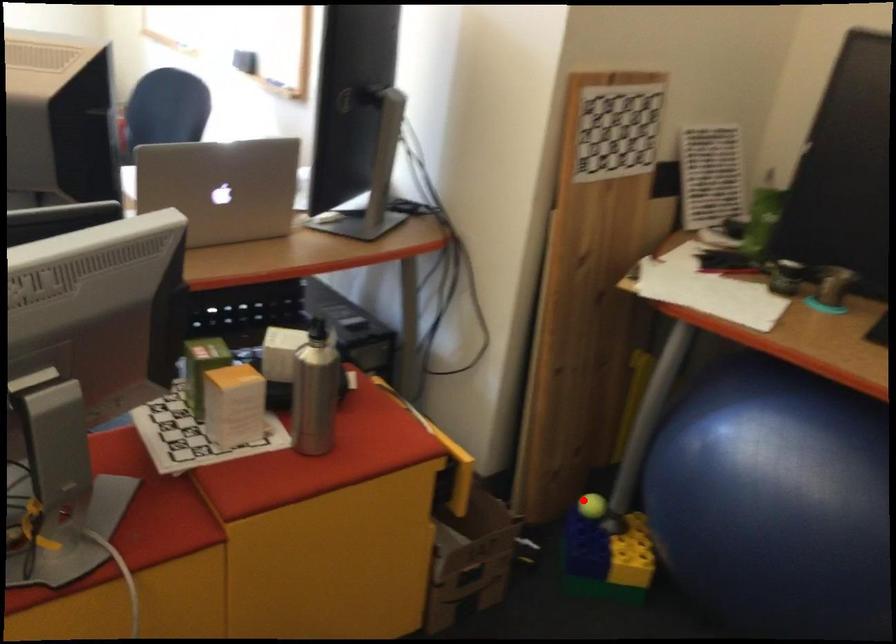
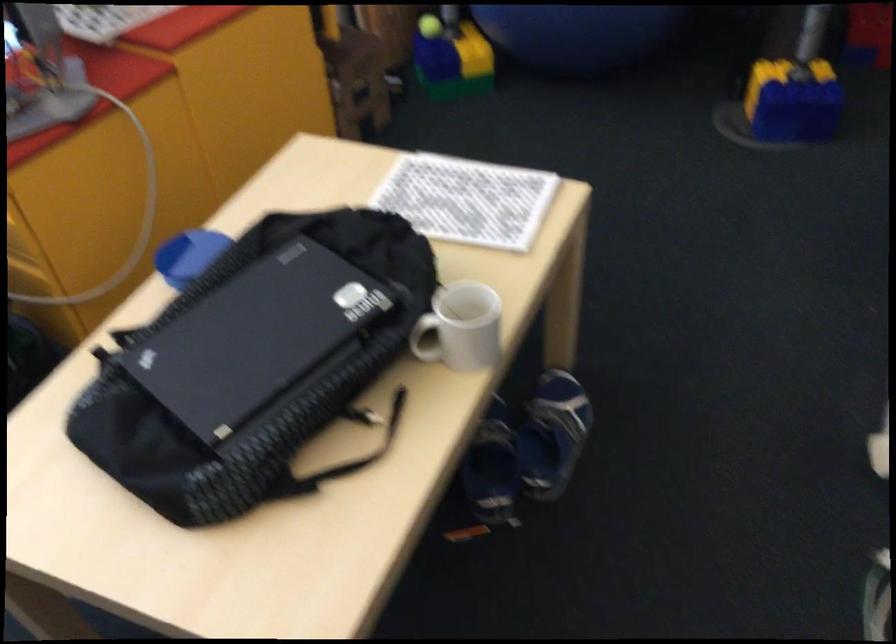
Question: I am providing you with two images of the same scene from different viewpoints. Given a red point in image1, look at the same physical point in image2. Is it:

Choices:
 (A) Closer to the viewpoint
 (B) Farther from the viewpoint

Answer: (B)